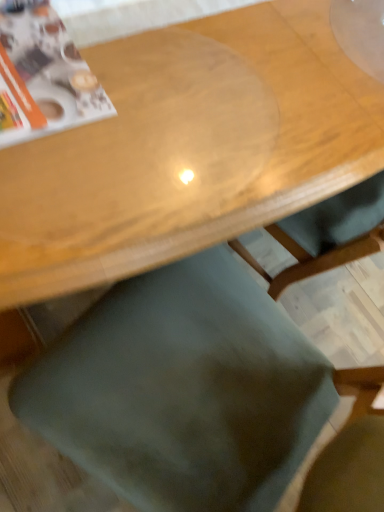
Question: From the image's perspective, is transparent plastic table at upper center above or below matte paper magazine at upper left?

Choices:
 (A) below
 (B) above

Answer: (B)

Question: Considering the positions of transparent plastic table at upper center and matte paper magazine at upper left in the image, is transparent plastic table at upper center wider or thinner than matte paper magazine at upper left?

Choices:
 (A) wide
 (B) thin

Answer: (A)

Question: Considering the real-world distances, which object is farthest from the green fabric chair at lower center?

Choices:
 (A) matte paper magazine at upper left
 (B) transparent plastic table at upper center

Answer: (A)

Question: Estimate the real-world distances between objects in this image. Which object is farther from the green fabric chair at lower center?

Choices:
 (A) matte paper magazine at upper left
 (B) transparent plastic table at upper center

Answer: (A)